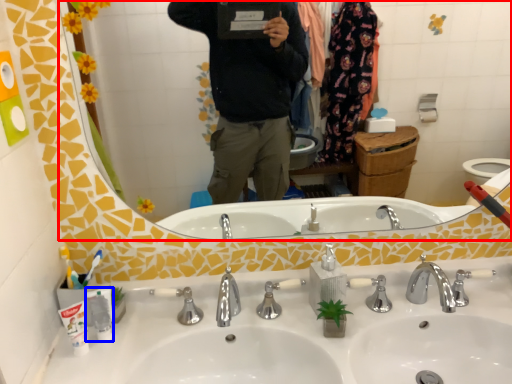
Question: Among these objects, which one is nearest to the camera, mirror (highlighted by a red box) or toiletry (highlighted by a blue box)?

Choices:
 (A) mirror
 (B) toiletry

Answer: (A)